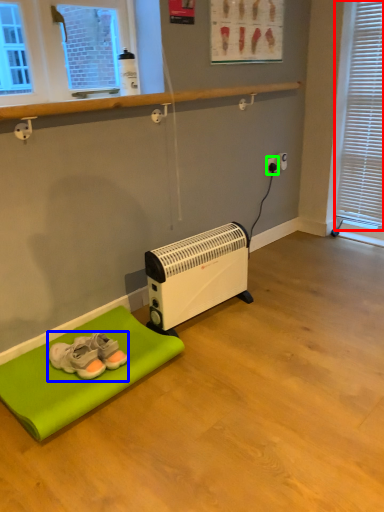
Question: Estimate the real-world distances between objects in this image. Which object is farther from blind (highlighted by a red box), footwear (highlighted by a blue box) or electric outlet (highlighted by a green box)?

Choices:
 (A) footwear
 (B) electric outlet

Answer: (A)